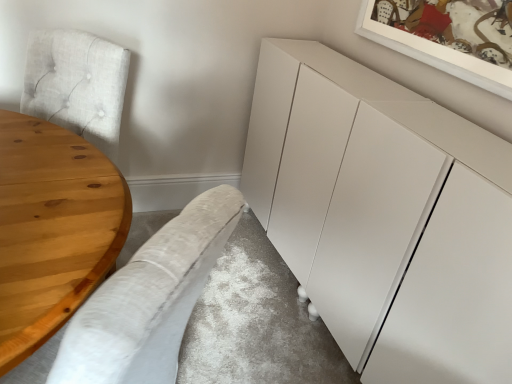
Question: Should I look upward or downward to see white matte cabinet at center?

Choices:
 (A) down
 (B) up

Answer: (A)

Question: From the image's perspective, would you say white matte cabinet at center is shown under natural wood table at left?

Choices:
 (A) no
 (B) yes

Answer: (A)

Question: Is the surface of white matte cabinet at center in direct contact with natural wood table at left?

Choices:
 (A) no
 (B) yes

Answer: (A)

Question: From a real-world perspective, is white matte cabinet at center below natural wood table at left?

Choices:
 (A) no
 (B) yes

Answer: (A)

Question: Is white matte cabinet at center oriented away from natural wood table at left?

Choices:
 (A) yes
 (B) no

Answer: (B)

Question: Considering the relative sizes of white matte cabinet at center and natural wood table at left in the image provided, is white matte cabinet at center bigger than natural wood table at left?

Choices:
 (A) no
 (B) yes

Answer: (B)

Question: Is white matte cabinet at center taller than natural wood table at left?

Choices:
 (A) no
 (B) yes

Answer: (B)

Question: Is white matte cabinet at center looking in the opposite direction of light gray fabric couch at lower left?

Choices:
 (A) no
 (B) yes

Answer: (A)

Question: Considering the relative sizes of white matte cabinet at center and light gray fabric couch at lower left in the image provided, is white matte cabinet at center bigger than light gray fabric couch at lower left?

Choices:
 (A) no
 (B) yes

Answer: (B)

Question: Can you confirm if white matte cabinet at center is shorter than light gray fabric couch at lower left?

Choices:
 (A) no
 (B) yes

Answer: (B)

Question: Is white matte cabinet at center at the left side of light gray fabric couch at lower left?

Choices:
 (A) yes
 (B) no

Answer: (B)

Question: From the image's perspective, is white matte cabinet at center on top of light gray fabric couch at lower left?

Choices:
 (A) no
 (B) yes

Answer: (B)

Question: From a real-world perspective, is white matte cabinet at center on light gray fabric couch at lower left?

Choices:
 (A) yes
 (B) no

Answer: (B)

Question: Can you confirm if natural wood table at left is positioned to the right of light gray fabric couch at lower left?

Choices:
 (A) no
 (B) yes

Answer: (A)